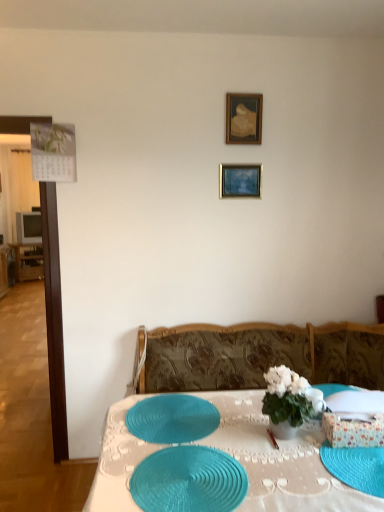
Question: Would you say teal woven placemat at center, positioned as the second tableware in back-to-front order, is a long distance from gold metallic picture frame at upper center, acting as the first picture frame starting from the bottom?

Choices:
 (A) no
 (B) yes

Answer: (B)

Question: From the image's perspective, is teal woven placemat at center, the first tableware in the front-to-back sequence, located above gold metallic picture frame at upper center, the 2th picture frame in the top-to-bottom sequence?

Choices:
 (A) no
 (B) yes

Answer: (A)

Question: Is teal woven placemat at center, positioned as the second tableware in back-to-front order, oriented away from gold metallic picture frame at upper center, the 2th picture frame in the top-to-bottom sequence?

Choices:
 (A) yes
 (B) no

Answer: (B)

Question: Is teal woven placemat at center, the first tableware in the front-to-back sequence, to the left of gold metallic picture frame at upper center, acting as the first picture frame starting from the bottom, from the viewer's perspective?

Choices:
 (A) no
 (B) yes

Answer: (B)

Question: Does teal woven placemat at center, the first tableware in the front-to-back sequence, have a smaller size compared to gold metallic picture frame at upper center, the 2th picture frame in the top-to-bottom sequence?

Choices:
 (A) yes
 (B) no

Answer: (B)

Question: From a real-world perspective, relative to white glossy vase at center, is teal woven placemat at center, positioned as the second tableware in back-to-front order, vertically above or below?

Choices:
 (A) below
 (B) above

Answer: (A)

Question: From the image's perspective, relative to white glossy vase at center, is teal woven placemat at center, positioned as the second tableware in back-to-front order, above or below?

Choices:
 (A) below
 (B) above

Answer: (A)

Question: Is point (168, 498) closer or farther from the camera than point (309, 385)?

Choices:
 (A) closer
 (B) farther

Answer: (A)

Question: Is teal woven placemat at center, positioned as the second tableware in back-to-front order, situated inside white glossy vase at center or outside?

Choices:
 (A) outside
 (B) inside

Answer: (A)

Question: Relative to teal woven placemat at center, which ranks as the 2th tableware in front-to-back order, is white glossy vase at center in front or behind?

Choices:
 (A) front
 (B) behind

Answer: (A)

Question: Is white glossy vase at center to the left or to the right of teal woven placemat at center, which ranks as the 2th tableware in front-to-back order, in the image?

Choices:
 (A) right
 (B) left

Answer: (A)

Question: Is point (288, 371) closer or farther from the camera than point (200, 400)?

Choices:
 (A) closer
 (B) farther

Answer: (A)

Question: From the image's perspective, is white glossy vase at center above or below teal woven placemat at center, which ranks as the 2th tableware in front-to-back order?

Choices:
 (A) above
 (B) below

Answer: (A)

Question: From a real-world perspective, is teal woven placemat at center, the first tableware in the front-to-back sequence, above or below gold metallic picture frame at upper center, acting as the first picture frame starting from the bottom?

Choices:
 (A) below
 (B) above

Answer: (A)

Question: From the image's perspective, is teal woven placemat at center, positioned as the second tableware in back-to-front order, located above or below gold metallic picture frame at upper center, the 2th picture frame in the top-to-bottom sequence?

Choices:
 (A) below
 (B) above

Answer: (A)